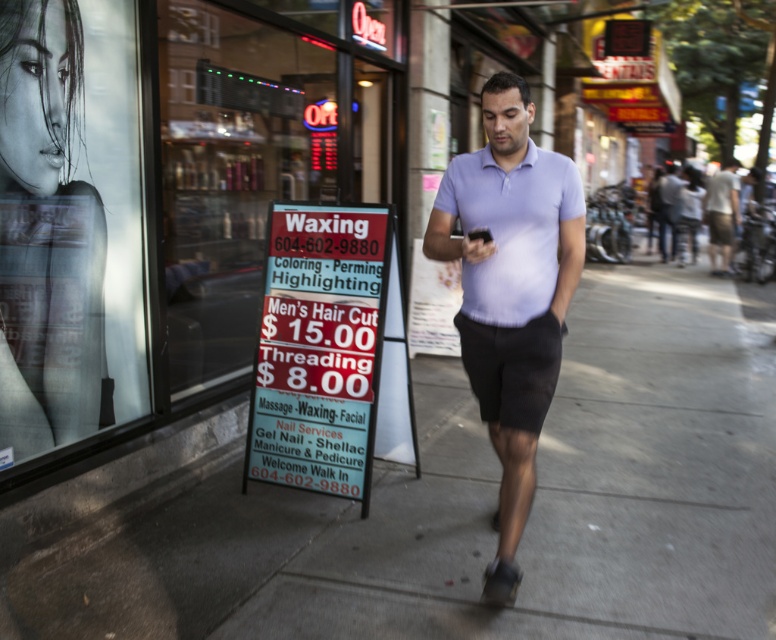
Question: Which point appears farthest from the camera in this image?

Choices:
 (A) (712, 236)
 (B) (470, 381)
 (C) (663, 180)
 (D) (641, 531)

Answer: (C)

Question: Can you confirm if smooth skin portrait at left is positioned to the left of lavender cotton/polyester polo shirt at center?

Choices:
 (A) no
 (B) yes

Answer: (B)

Question: Does transparent glass signboard at center have a smaller size compared to black cotton shorts at center?

Choices:
 (A) yes
 (B) no

Answer: (B)

Question: Which of the following is the closest to the observer?

Choices:
 (A) (499, 422)
 (B) (376, 113)
 (C) (664, 170)
 (D) (88, 260)

Answer: (A)

Question: In this image, where is lavender cotton/polyester polo shirt at center located relative to black cotton shorts at center?

Choices:
 (A) right
 (B) left

Answer: (B)

Question: Which is nearer to the transparent glass signboard at center?

Choices:
 (A) light purple cotton shirt at center
 (B) lavender cotton polo shirt at center
 (C) black cotton shorts at center

Answer: (C)